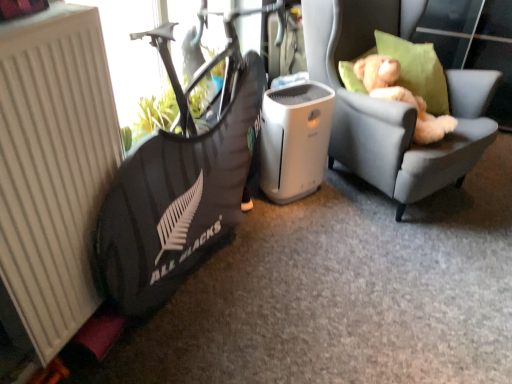
Question: From a real-world perspective, is black fabric bean bag chair at left on white matte radiator at left?

Choices:
 (A) yes
 (B) no

Answer: (B)

Question: From the image's perspective, is black fabric bean bag chair at left below white matte radiator at left?

Choices:
 (A) no
 (B) yes

Answer: (A)

Question: Is black fabric bean bag chair at left to the left of white matte radiator at left from the viewer's perspective?

Choices:
 (A) yes
 (B) no

Answer: (B)

Question: Does black fabric bean bag chair at left have a greater width compared to white matte radiator at left?

Choices:
 (A) yes
 (B) no

Answer: (A)

Question: Is black fabric bean bag chair at left further to the viewer compared to white matte radiator at left?

Choices:
 (A) no
 (B) yes

Answer: (B)

Question: Is white matte radiator at left wider or thinner than light brown plush teddy bear at upper right?

Choices:
 (A) thin
 (B) wide

Answer: (A)

Question: Is white matte radiator at left bigger or smaller than light brown plush teddy bear at upper right?

Choices:
 (A) small
 (B) big

Answer: (B)

Question: From a real-world perspective, is white matte radiator at left positioned above or below light brown plush teddy bear at upper right?

Choices:
 (A) above
 (B) below

Answer: (A)

Question: From the image's perspective, is white matte radiator at left positioned above or below light brown plush teddy bear at upper right?

Choices:
 (A) below
 (B) above

Answer: (A)

Question: From their relative heights in the image, would you say light gray fabric chair at right is taller or shorter than white matte radiator at left?

Choices:
 (A) tall
 (B) short

Answer: (A)

Question: Considering the positions of point (412, 19) and point (8, 213), is point (412, 19) closer or farther from the camera than point (8, 213)?

Choices:
 (A) closer
 (B) farther

Answer: (B)

Question: From the image's perspective, is light gray fabric chair at right positioned above or below white matte radiator at left?

Choices:
 (A) above
 (B) below

Answer: (A)

Question: Considering the relative positions of light gray fabric chair at right and white matte radiator at left in the image provided, is light gray fabric chair at right to the left or to the right of white matte radiator at left?

Choices:
 (A) left
 (B) right

Answer: (B)

Question: Is black fabric bean bag chair at left taller or shorter than light gray fabric chair at right?

Choices:
 (A) tall
 (B) short

Answer: (B)

Question: Is black fabric bean bag chair at left in front of or behind light gray fabric chair at right in the image?

Choices:
 (A) front
 (B) behind

Answer: (A)